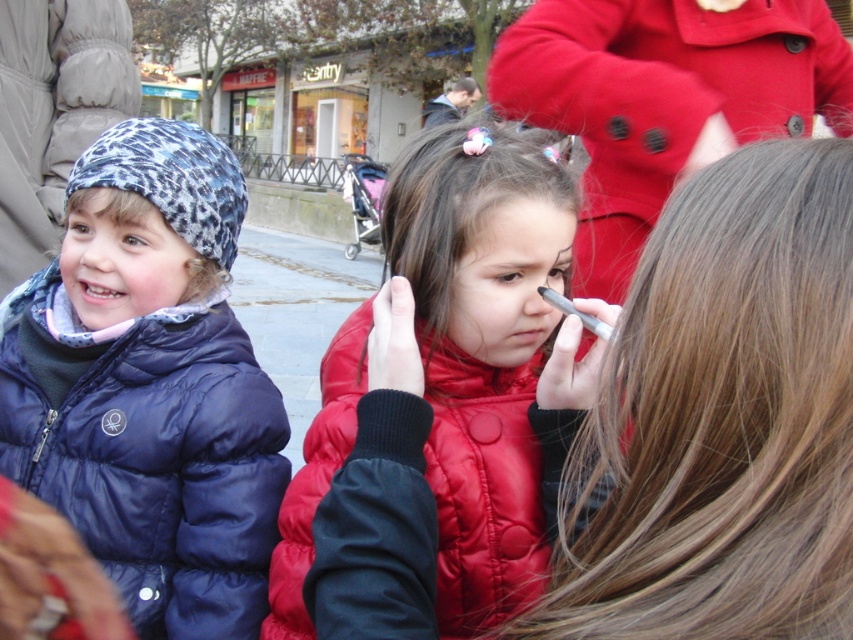
You are a photographer trying to capture both the shiny red jacket at center and the matte blue puffer jacket at left in a single frame. Based on their sizes, which jacket would appear smaller in the photo?

The shiny red jacket at center appears smaller in the photo because it has a lesser width compared to the matte blue puffer jacket at left.

You are a photographer trying to capture both the shiny red jacket at center and the matte red coat at center in the same frame. Based on their widths, which object should you focus on first to ensure both are fully visible?

The shiny red jacket at center has a lesser width compared to the matte red coat at center, so you should focus on the matte red coat at center first to ensure both are fully visible.